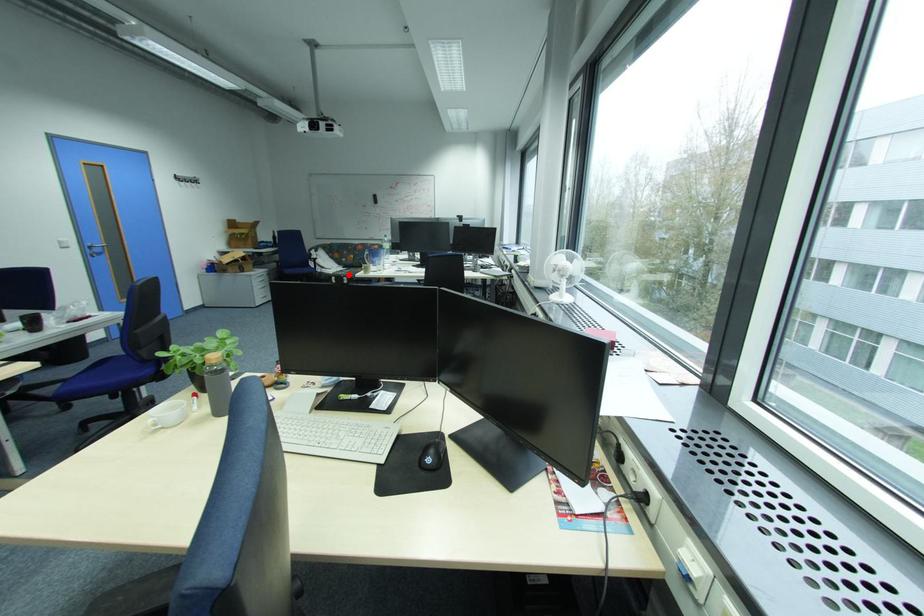
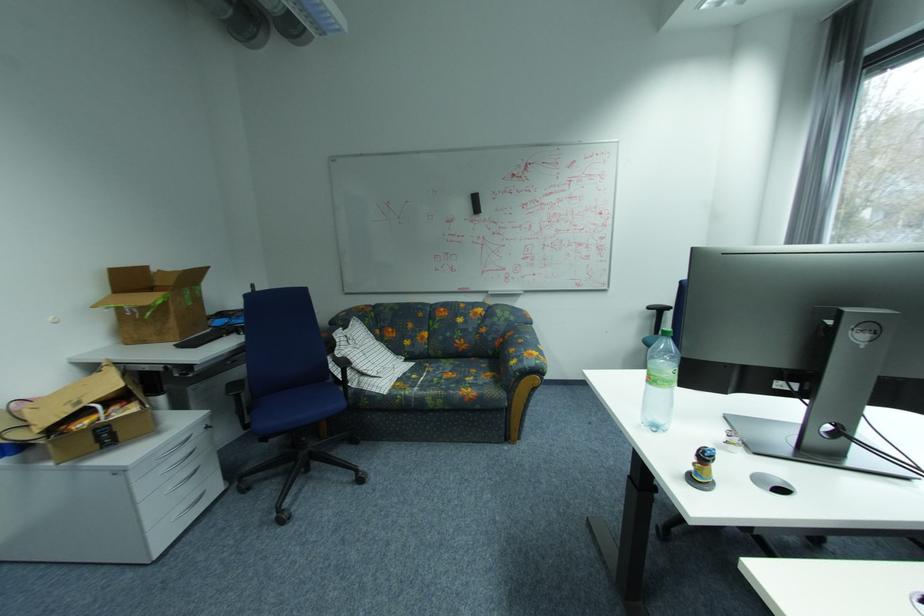
Where in the second image is the point corresponding to the highlighted location from the first image?

(416, 392)